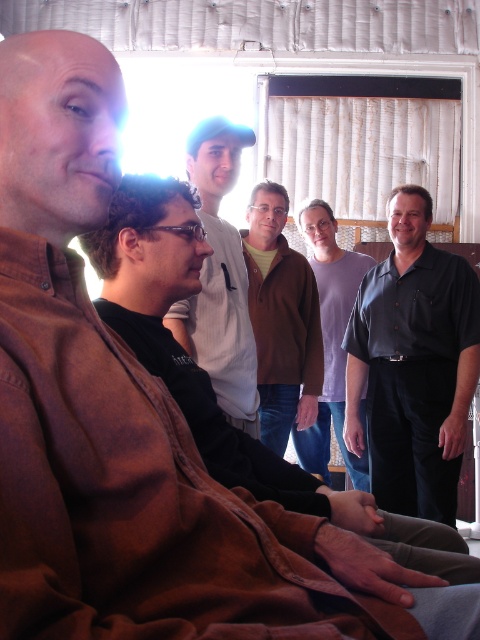
Question: Does brown sweater at center appear on the right side of purple cotton shirt at center?

Choices:
 (A) yes
 (B) no

Answer: (B)

Question: Is black shirt at right above purple cotton shirt at center?

Choices:
 (A) yes
 (B) no

Answer: (B)

Question: Which point is closer to the camera?

Choices:
 (A) (283, 394)
 (B) (396, 420)

Answer: (B)

Question: Which point is farther to the camera?

Choices:
 (A) purple cotton shirt at center
 (B) black shirt at right
 (C) white cotton shirt at center
 (D) brown sweater at center

Answer: (A)

Question: Does black shirt at right have a greater width compared to white cotton shirt at center?

Choices:
 (A) no
 (B) yes

Answer: (B)

Question: Among these objects, which one is farthest from the camera?

Choices:
 (A) black shirt at right
 (B) brown sweater at center
 (C) white cotton shirt at center
 (D) purple cotton shirt at center

Answer: (D)